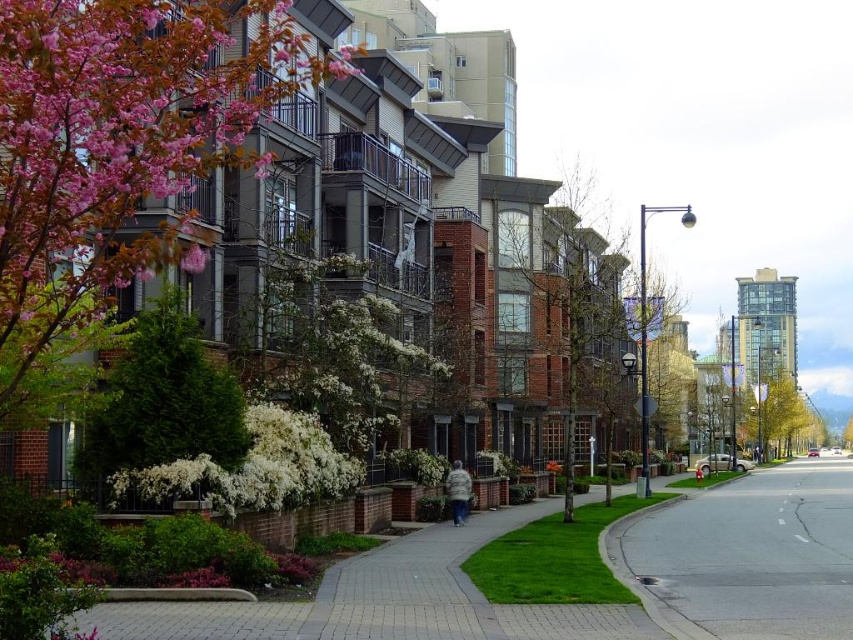
You are standing at the point labeled as point (451, 593) in the image. Based on the scene description, what surface are you currently standing on?

The point (451, 593) corresponds to the paved brick sidewalk at center, so you are standing on the paved brick sidewalk at center.

You are standing on the sidewalk in the urban street scene. You notice two points marked in the image. The first point is at coordinates point (583,355) and the second is at point (109,454). Which point is closer to you?

Point (109,454) is closer to you because the description states that point (583,355) is further to the camera than point (109,454).

You are a city planner assessing the urban space. You need to determine which of the two plants in the center of the image, the green leafy tree at center or the green textured bush at center, would cast more shade over the sidewalk during midday. Based on their sizes, which one would provide more shade?

The green leafy tree at center is larger in size than the green textured bush at center, so it would cast more shade over the sidewalk during midday.